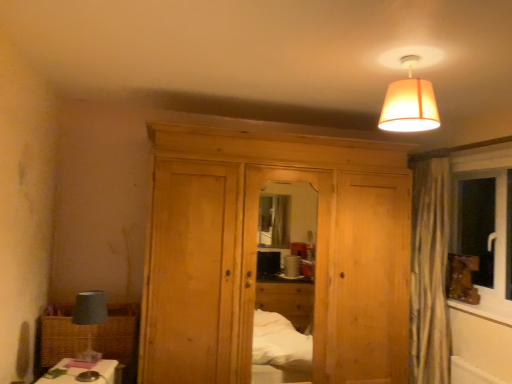
Question: Considering the relative positions of orange fabric lampshade at upper center and wooden frame at right in the image provided, is orange fabric lampshade at upper center behind wooden frame at right?

Choices:
 (A) no
 (B) yes

Answer: (A)

Question: Does orange fabric lampshade at upper center have a greater width compared to wooden frame at right?

Choices:
 (A) no
 (B) yes

Answer: (B)

Question: From the image's perspective, is orange fabric lampshade at upper center on top of wooden frame at right?

Choices:
 (A) yes
 (B) no

Answer: (A)

Question: Is orange fabric lampshade at upper center thinner than wooden frame at right?

Choices:
 (A) no
 (B) yes

Answer: (A)

Question: Is orange fabric lampshade at upper center aimed at wooden frame at right?

Choices:
 (A) no
 (B) yes

Answer: (A)

Question: Based on their sizes in the image, would you say woven brown picnic basket at lower left is bigger or smaller than wooden frame at right?

Choices:
 (A) big
 (B) small

Answer: (A)

Question: Is point (131, 329) positioned closer to the camera than point (466, 304)?

Choices:
 (A) closer
 (B) farther

Answer: (A)

Question: Is woven brown picnic basket at lower left taller or shorter than wooden frame at right?

Choices:
 (A) tall
 (B) short

Answer: (A)

Question: In terms of width, does woven brown picnic basket at lower left look wider or thinner when compared to wooden frame at right?

Choices:
 (A) wide
 (B) thin

Answer: (A)

Question: From the image's perspective, is natural wood dresser at center positioned above or below matte gray lampshade at left?

Choices:
 (A) below
 (B) above

Answer: (B)

Question: Relative to matte gray lampshade at left, is natural wood dresser at center in front or behind?

Choices:
 (A) front
 (B) behind

Answer: (B)

Question: Is natural wood dresser at center taller or shorter than matte gray lampshade at left?

Choices:
 (A) short
 (B) tall

Answer: (B)

Question: Do you think natural wood dresser at center is within matte gray lampshade at left, or outside of it?

Choices:
 (A) outside
 (B) inside

Answer: (A)

Question: Based on their sizes in the image, would you say wooden frame at right is bigger or smaller than natural wood dresser at center?

Choices:
 (A) big
 (B) small

Answer: (B)

Question: From the image's perspective, is wooden frame at right positioned above or below natural wood dresser at center?

Choices:
 (A) below
 (B) above

Answer: (A)